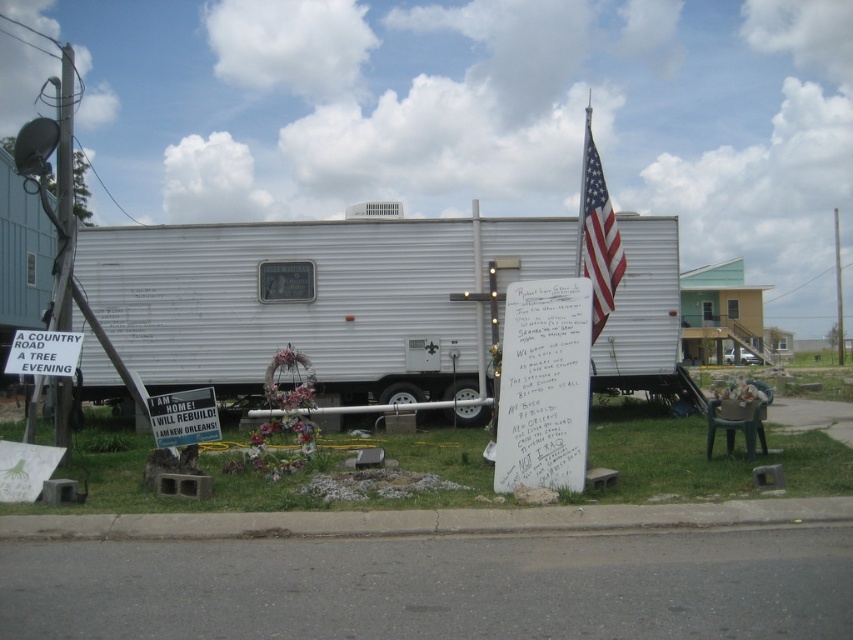
Question: Is white corrugated metal trailer at center above white paper sign at lower left?

Choices:
 (A) yes
 (B) no

Answer: (A)

Question: Can you confirm if white corrugated metal trailer at center is bigger than american flag at center?

Choices:
 (A) no
 (B) yes

Answer: (A)

Question: Which point is farther to the camera?

Choices:
 (A) white paper at center
 (B) white paper sign at lower left
 (C) metallic silver sign at lower center

Answer: (B)

Question: Is white paper at center thinner than american flag at center?

Choices:
 (A) yes
 (B) no

Answer: (A)

Question: Among these points, which one is nearest to the camera?

Choices:
 (A) (590, 150)
 (B) (508, 486)

Answer: (B)

Question: Which point is farther to the camera?

Choices:
 (A) white paper at center
 (B) metallic silver sign at lower center

Answer: (B)